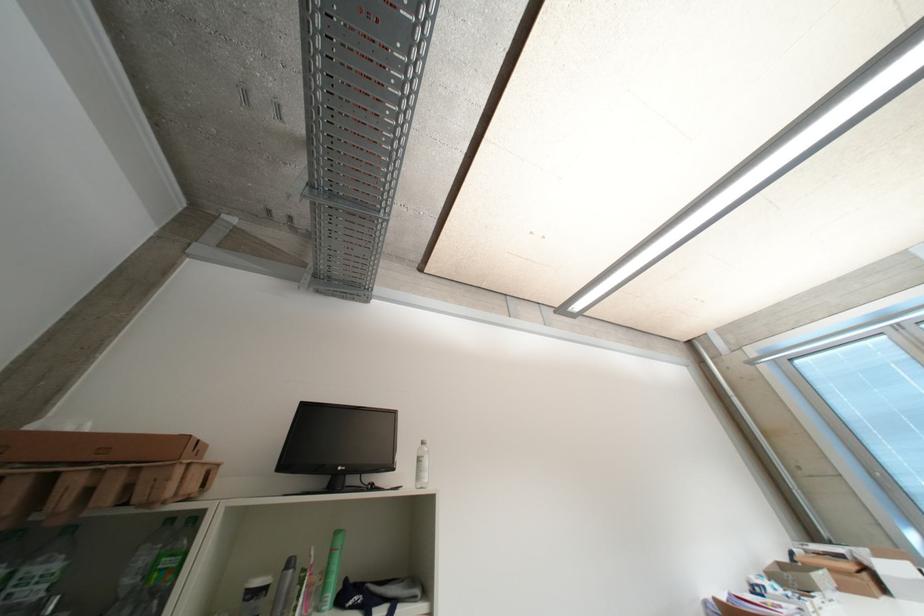
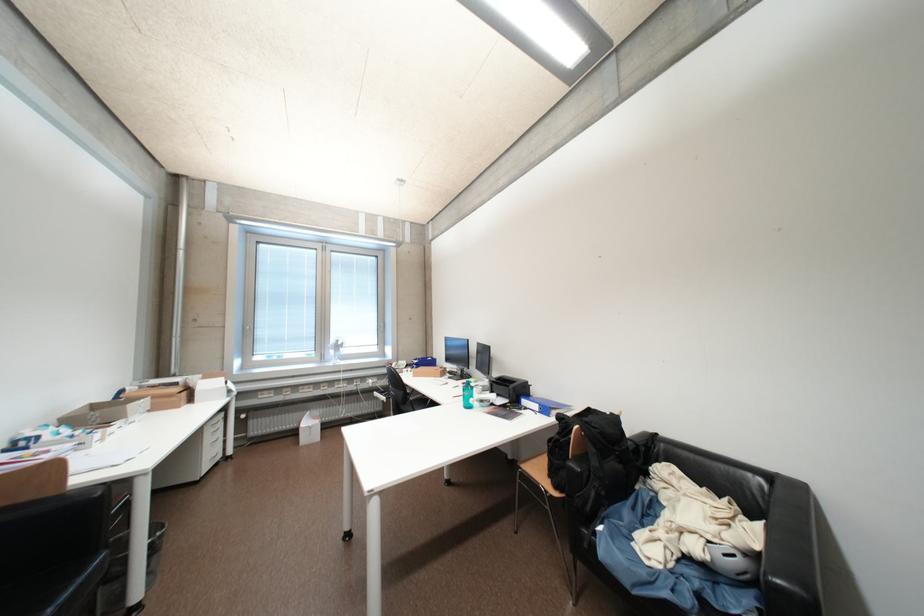
In the second image, find the point that corresponds to (x=873, y=578) in the first image.

(192, 395)